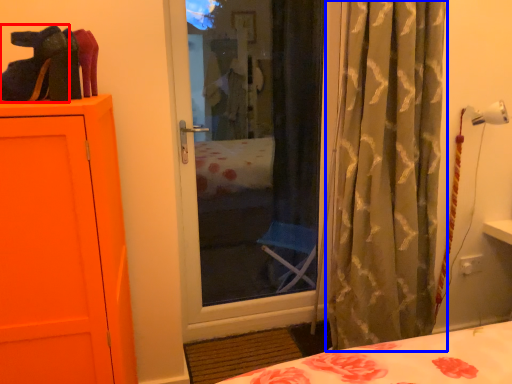
Question: Which object is further to the camera taking this photo, shoe (highlighted by a red box) or curtain (highlighted by a blue box)?

Choices:
 (A) shoe
 (B) curtain

Answer: (B)